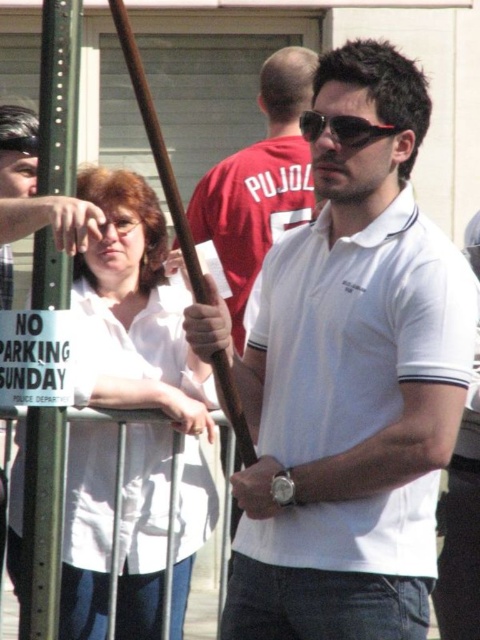
Which is more to the left, green metallic pole at left or sunglasses at center?

Positioned to the left is green metallic pole at left.

How far apart are green metallic pole at left and sunglasses at center?

green metallic pole at left is 3.70 meters away from sunglasses at center.

Image resolution: width=480 pixels, height=640 pixels. Describe the element at coordinates (41, 524) in the screenshot. I see `green metallic pole at left` at that location.

Locate an element on the screen. The image size is (480, 640). green metallic pole at left is located at coordinates (41, 524).

Who is higher up, white cotton polo shirt at center or green metallic pole at left?

green metallic pole at left is above.

Who is positioned more to the right, white cotton polo shirt at center or green metallic pole at left?

white cotton polo shirt at center

Between point (384, 589) and point (57, 8), which one is positioned behind?

The point (384, 589) is behind.

Locate an element on the screen. white cotton polo shirt at center is located at coordinates (351, 381).

Is white cotton polo shirt at center wider than sunglasses at center?

No.

Is white cotton polo shirt at center bigger than sunglasses at center?

Incorrect, white cotton polo shirt at center is not larger than sunglasses at center.

I want to click on white cotton polo shirt at center, so click(x=351, y=381).

Where is `white cotton polo shirt at center`? white cotton polo shirt at center is located at coordinates (351, 381).